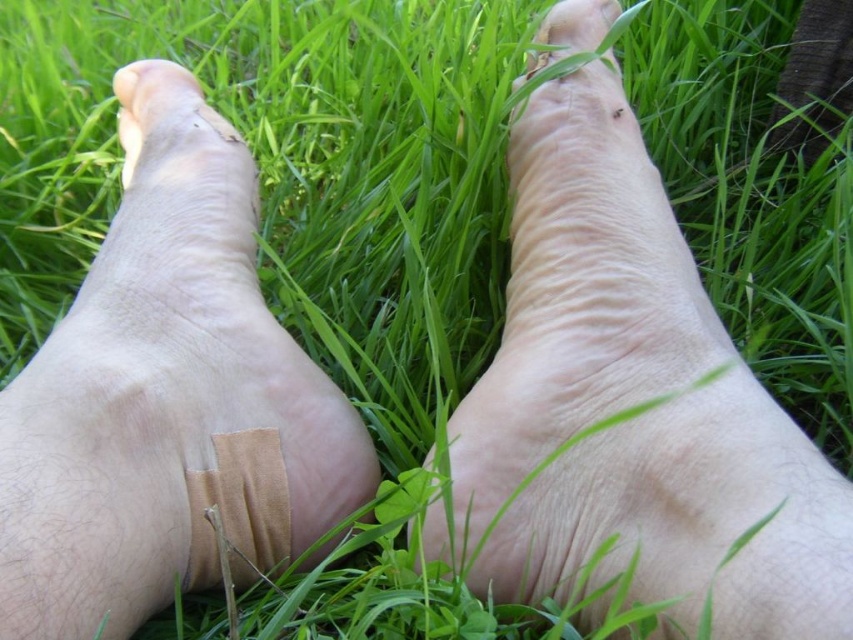
You are a nurse checking the bandages on two feet. The transparent beige bandage at lower left and beige fabric bandage at center are both on the same foot. Which bandage is closer to the toes?

The transparent beige bandage at lower left is closer to the toes because it is positioned to the left of the beige fabric bandage at center, which would place it nearer to the toe area on the foot.

Looking at the scene with the smooth skin leg at upper right and the beige fabric bandage at center, which object is wider?

The smooth skin leg at upper right is wider than the beige fabric bandage at center.

You are a photographer trying to capture a closeup of both the smooth skin leg at upper right and the pale skin toe at upper left in the image. Given their distance apart, can you fit both into a single frame without zooming in? The camera has a standard lens with a field of view that can capture objects up to 20 inches apart in this context.

The smooth skin leg at upper right and the pale skin toe at upper left are 18.09 inches apart from each other, which is within the camera lens field of view limit of 20 inches. Therefore, both can be captured in a single frame without zooming in.